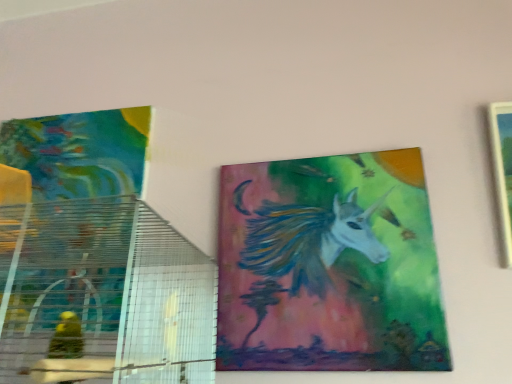
Question: Which direction should I rotate to look at painted unicorn at center, positioned as the second picture frame in right-to-left order, — up or down?

Choices:
 (A) up
 (B) down

Answer: (B)

Question: From the image's perspective, would you say painted unicorn at center, the first picture frame when ordered from left to right, is positioned over wooden frame at right, which ranks as the first picture frame in right-to-left order?

Choices:
 (A) yes
 (B) no

Answer: (B)

Question: Is painted unicorn at center, positioned as the second picture frame in right-to-left order, positioned before wooden frame at right, which ranks as the first picture frame in right-to-left order?

Choices:
 (A) no
 (B) yes

Answer: (A)

Question: From a real-world perspective, is painted unicorn at center, the first picture frame when ordered from left to right, physically above wooden frame at right, positioned as the second picture frame in left-to-right order?

Choices:
 (A) yes
 (B) no

Answer: (B)

Question: Is painted unicorn at center, the first picture frame when ordered from left to right, smaller than wooden frame at right, positioned as the second picture frame in left-to-right order?

Choices:
 (A) no
 (B) yes

Answer: (B)

Question: Are painted unicorn at center, the first picture frame when ordered from left to right, and wooden frame at right, positioned as the second picture frame in left-to-right order, located far from each other?

Choices:
 (A) no
 (B) yes

Answer: (A)

Question: Can you confirm if painted unicorn at center, the first picture frame when ordered from left to right, is bigger than wooden frame at right, positioned as the second picture frame in left-to-right order?

Choices:
 (A) yes
 (B) no

Answer: (B)

Question: Can you confirm if wooden frame at right, which ranks as the first picture frame in right-to-left order, is smaller than painted unicorn at center, the first picture frame when ordered from left to right?

Choices:
 (A) no
 (B) yes

Answer: (A)

Question: Would you say wooden frame at right, which ranks as the first picture frame in right-to-left order, is outside painted unicorn at center, the first picture frame when ordered from left to right?

Choices:
 (A) no
 (B) yes

Answer: (B)

Question: Would you say wooden frame at right, which ranks as the first picture frame in right-to-left order, contains painted unicorn at center, the first picture frame when ordered from left to right?

Choices:
 (A) no
 (B) yes

Answer: (A)

Question: From the image's perspective, is wooden frame at right, positioned as the second picture frame in left-to-right order, above painted unicorn at center, positioned as the second picture frame in right-to-left order?

Choices:
 (A) yes
 (B) no

Answer: (A)

Question: Is wooden frame at right, which ranks as the first picture frame in right-to-left order, at the left side of painted unicorn at center, positioned as the second picture frame in right-to-left order?

Choices:
 (A) yes
 (B) no

Answer: (B)

Question: Is wooden frame at right, positioned as the second picture frame in left-to-right order, with painted unicorn at center, the first picture frame when ordered from left to right?

Choices:
 (A) yes
 (B) no

Answer: (B)

Question: Is painted unicorn at center, positioned as the second picture frame in right-to-left order, inside or outside of wooden frame at right, positioned as the second picture frame in left-to-right order?

Choices:
 (A) inside
 (B) outside

Answer: (B)